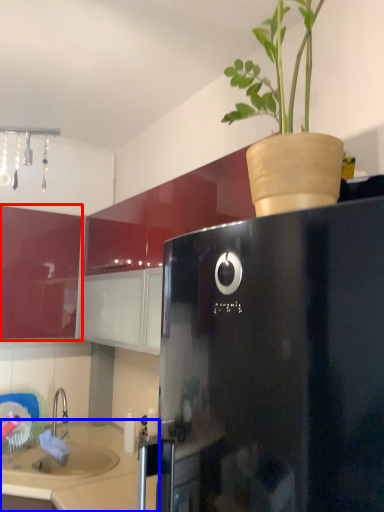
Question: Among these objects, which one is nearest to the camera, cabinetry (highlighted by a red box) or counter top (highlighted by a blue box)?

Choices:
 (A) cabinetry
 (B) counter top

Answer: (B)